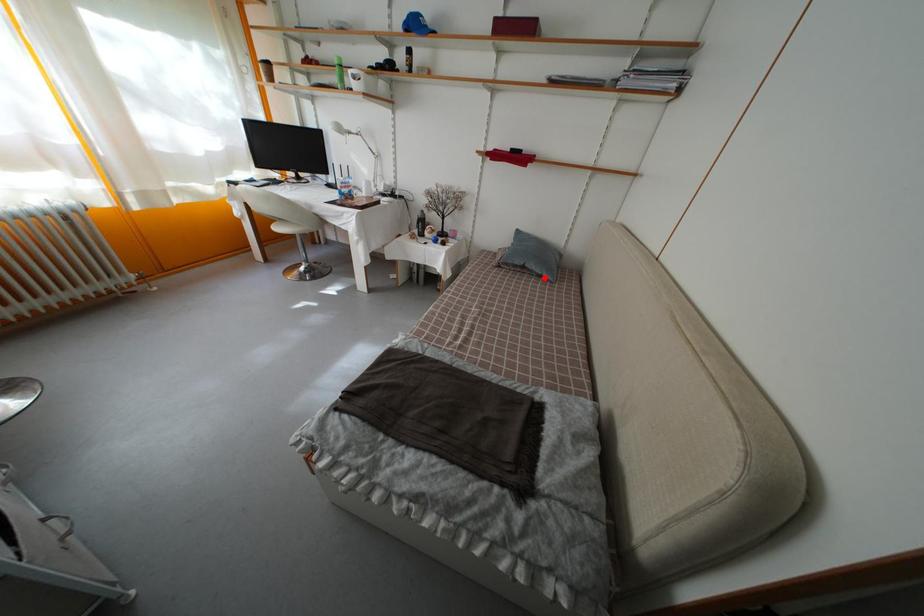
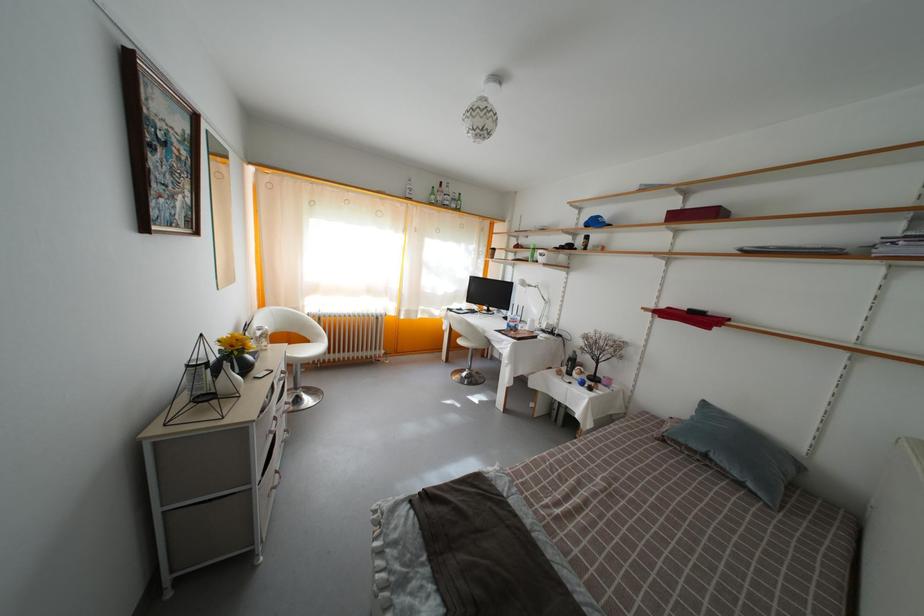
Find the pixel in the second image that matches the highlighted location in the first image.

(743, 482)